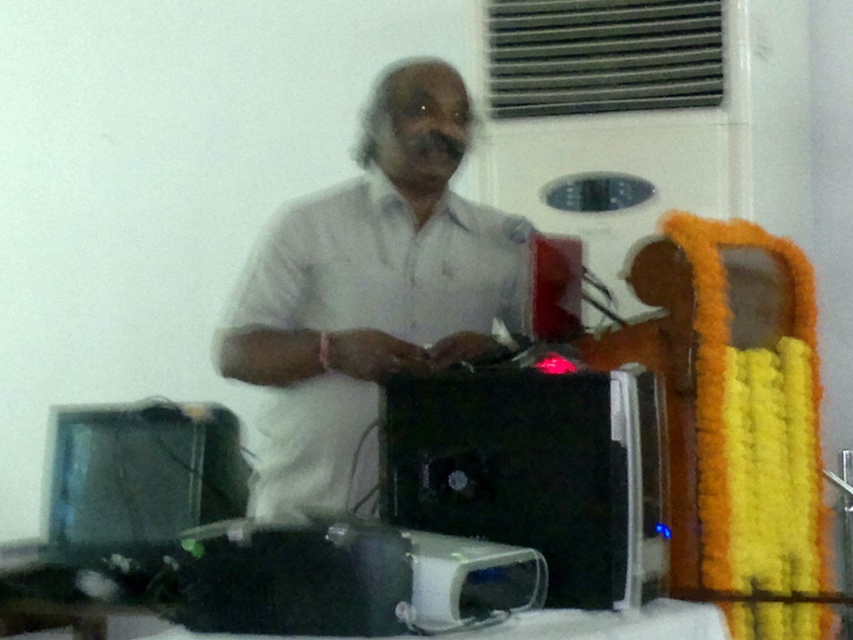
Question: Does white matte shirt at center appear on the left side of black plastic computer at center?

Choices:
 (A) no
 (B) yes

Answer: (B)

Question: Which object appears closest to the camera in this image?

Choices:
 (A) black plastic computer at center
 (B) black plastic computer at lower left
 (C) white matte shirt at center

Answer: (A)

Question: Is white matte shirt at center to the left of black plastic computer at center from the viewer's perspective?

Choices:
 (A) no
 (B) yes

Answer: (B)

Question: Which point is farther to the camera?

Choices:
 (A) (341, 188)
 (B) (202, 490)
 (C) (604, 529)

Answer: (B)

Question: Among these objects, which one is nearest to the camera?

Choices:
 (A) white matte shirt at center
 (B) black plastic computer at lower left

Answer: (A)

Question: Does white matte shirt at center appear under black plastic computer at lower left?

Choices:
 (A) yes
 (B) no

Answer: (B)